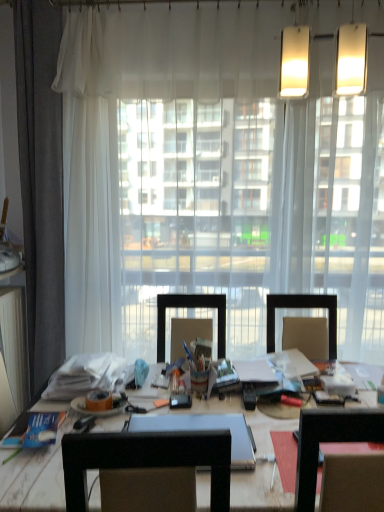
Question: From a real-world perspective, is blue paper book at lower left located higher than orange matte adhesive tape at center?

Choices:
 (A) yes
 (B) no

Answer: (B)

Question: Could orange matte adhesive tape at center be considered to be inside blue paper book at lower left?

Choices:
 (A) yes
 (B) no

Answer: (B)

Question: From a real-world perspective, is blue paper book at lower left under orange matte adhesive tape at center?

Choices:
 (A) no
 (B) yes

Answer: (B)

Question: Considering the relative sizes of blue paper book at lower left and orange matte adhesive tape at center in the image provided, is blue paper book at lower left shorter than orange matte adhesive tape at center?

Choices:
 (A) yes
 (B) no

Answer: (A)

Question: Considering the relative sizes of blue paper book at lower left and orange matte adhesive tape at center in the image provided, is blue paper book at lower left thinner than orange matte adhesive tape at center?

Choices:
 (A) no
 (B) yes

Answer: (A)

Question: Would you say orange matte adhesive tape at center is to the left or to the right of wooden desk at center in the picture?

Choices:
 (A) right
 (B) left

Answer: (B)

Question: Is point pos(87,393) closer or farther from the camera than point pos(317,482)?

Choices:
 (A) farther
 (B) closer

Answer: (A)

Question: Relative to wooden desk at center, is orange matte adhesive tape at center in front or behind?

Choices:
 (A) behind
 (B) front

Answer: (A)

Question: Looking at their shapes, would you say orange matte adhesive tape at center is wider or thinner than wooden desk at center?

Choices:
 (A) wide
 (B) thin

Answer: (B)

Question: Do you think blue paper book at lower left is within orange matte adhesive tape at center, or outside of it?

Choices:
 (A) outside
 (B) inside

Answer: (A)

Question: Is point (36, 436) closer or farther from the camera than point (97, 397)?

Choices:
 (A) closer
 (B) farther

Answer: (A)

Question: Is blue paper book at lower left taller or shorter than orange matte adhesive tape at center?

Choices:
 (A) short
 (B) tall

Answer: (A)

Question: From a real-world perspective, is blue paper book at lower left physically located above or below orange matte adhesive tape at center?

Choices:
 (A) above
 (B) below

Answer: (B)

Question: Considering the relative positions of wooden desk at center and orange matte adhesive tape at center in the image provided, is wooden desk at center to the left or to the right of orange matte adhesive tape at center?

Choices:
 (A) right
 (B) left

Answer: (A)

Question: Relative to orange matte adhesive tape at center, is wooden desk at center in front or behind?

Choices:
 (A) behind
 (B) front

Answer: (B)